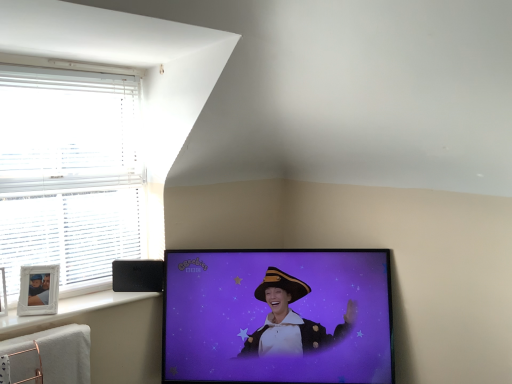
Question: From the image's perspective, is black glossy tv at center below white plastic frame at lower left?

Choices:
 (A) no
 (B) yes

Answer: (B)

Question: Does black glossy tv at center have a lesser height compared to white plastic frame at lower left?

Choices:
 (A) yes
 (B) no

Answer: (B)

Question: From a real-world perspective, is black glossy tv at center under white plastic frame at lower left?

Choices:
 (A) no
 (B) yes

Answer: (B)

Question: Considering the relative positions of black glossy tv at center and white plastic frame at lower left in the image provided, is black glossy tv at center in front of white plastic frame at lower left?

Choices:
 (A) no
 (B) yes

Answer: (A)

Question: Is black glossy tv at center at the left side of white plastic frame at lower left?

Choices:
 (A) yes
 (B) no

Answer: (B)

Question: From the image's perspective, is black plastic speaker at lower left above or below black glossy tv at center?

Choices:
 (A) below
 (B) above

Answer: (B)

Question: From a real-world perspective, is black plastic speaker at lower left positioned above or below black glossy tv at center?

Choices:
 (A) below
 (B) above

Answer: (B)

Question: Considering their positions, is black plastic speaker at lower left located in front of or behind black glossy tv at center?

Choices:
 (A) behind
 (B) front

Answer: (A)

Question: In terms of width, does black plastic speaker at lower left look wider or thinner when compared to black glossy tv at center?

Choices:
 (A) wide
 (B) thin

Answer: (B)

Question: Is white plastic frame at lower left wider or thinner than black plastic speaker at lower left?

Choices:
 (A) wide
 (B) thin

Answer: (A)

Question: Based on their positions, is white plastic frame at lower left located to the left or right of black plastic speaker at lower left?

Choices:
 (A) left
 (B) right

Answer: (A)

Question: From the image's perspective, is white plastic frame at lower left located above or below black plastic speaker at lower left?

Choices:
 (A) above
 (B) below

Answer: (B)

Question: In the image, is white plastic frame at lower left positioned in front of or behind black plastic speaker at lower left?

Choices:
 (A) front
 (B) behind

Answer: (A)

Question: From their relative heights in the image, would you say black plastic speaker at lower left is taller or shorter than white plastic frame at lower left?

Choices:
 (A) tall
 (B) short

Answer: (A)

Question: From the image's perspective, relative to white plastic frame at lower left, is black plastic speaker at lower left above or below?

Choices:
 (A) below
 (B) above

Answer: (B)